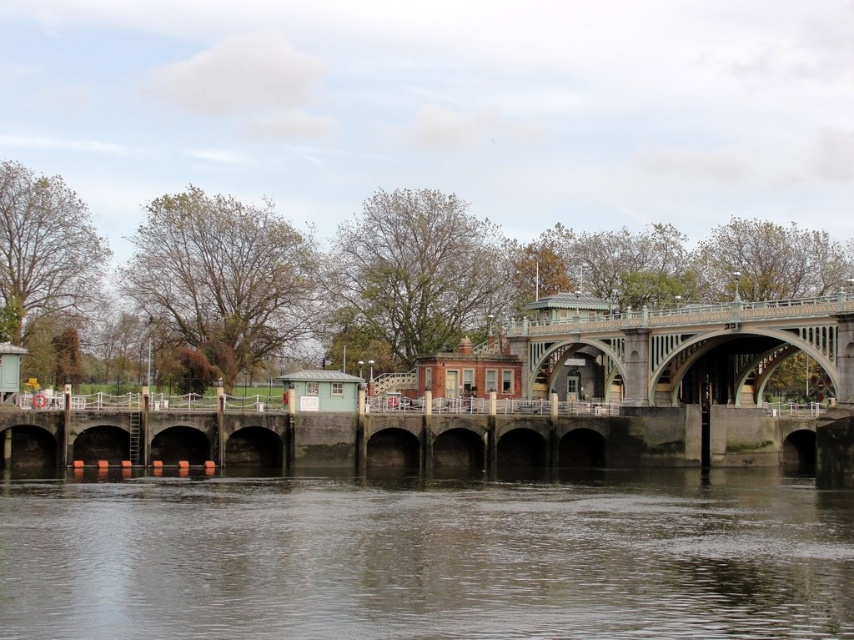
Which is below, brown murky water at lower center or green stone bridge at center?

brown murky water at lower center is lower down.

Is point (371, 609) closer to viewer compared to point (774, 316)?

Yes, it is.

Locate an element on the screen. Image resolution: width=854 pixels, height=640 pixels. brown murky water at lower center is located at coordinates (425, 557).